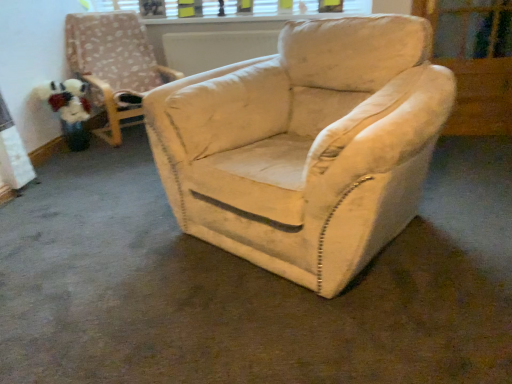
The width and height of the screenshot is (512, 384). What do you see at coordinates (69, 109) in the screenshot? I see `fluffy fabric toy at left` at bounding box center [69, 109].

The width and height of the screenshot is (512, 384). Identify the location of transparent glass screen door at upper right. (474, 61).

Where is `chair above the transparent glass screen door at upper right (from a real-world perspective)`? This screenshot has height=384, width=512. chair above the transparent glass screen door at upper right (from a real-world perspective) is located at coordinates (113, 63).

Is velvet beige armchair at center at the back of transparent glass screen door at upper right?

That's not correct — transparent glass screen door at upper right is not looking away from velvet beige armchair at center.

Which object is further away from the camera taking this photo, transparent glass screen door at upper right or velvet beige armchair at center?

Positioned behind is velvet beige armchair at center.

How distant is transparent glass screen door at upper right from velvet beige armchair at center?

The distance of transparent glass screen door at upper right from velvet beige armchair at center is 2.46 meters.

Where is `chair below the white plastic window frame at upper center (from the image's perspective)`? This screenshot has width=512, height=384. chair below the white plastic window frame at upper center (from the image's perspective) is located at coordinates point(113,63).

Can you confirm if white plastic window frame at upper center is smaller than velvet beige armchair at center?

Yes, white plastic window frame at upper center is smaller than velvet beige armchair at center.

Does point (254, 0) come farther from viewer compared to point (69, 65)?

Yes, point (254, 0) is farther from viewer.

How many degrees apart are the facing directions of velvet beige armchair at center and white plastic window frame at upper center?

The angle between the facing direction of velvet beige armchair at center and the facing direction of white plastic window frame at upper center is 47.7 degrees.

Locate an element on the screen. chair that is in front of the white plastic window frame at upper center is located at coordinates (113, 63).

Does point (89, 74) come closer to viewer compared to point (207, 4)?

Yes, point (89, 74) is in front of point (207, 4).

Considering the relative positions of velvet beige armchair at center and white plastic window frame at upper center in the image provided, is velvet beige armchair at center to the left or to the right of white plastic window frame at upper center?

velvet beige armchair at center is to the left of white plastic window frame at upper center.

Can you confirm if velvet beige armchair at center is positioned to the right of transparent glass screen door at upper right?

In fact, velvet beige armchair at center is to the left of transparent glass screen door at upper right.

From a real-world perspective, is velvet beige armchair at center located higher than transparent glass screen door at upper right?

Yes.

Does velvet beige armchair at center have a lesser height compared to transparent glass screen door at upper right?

In fact, velvet beige armchair at center may be taller than transparent glass screen door at upper right.

Is velvet beige armchair at center located outside transparent glass screen door at upper right?

velvet beige armchair at center lies outside transparent glass screen door at upper right's area.

At what (x,y) coordinates should I click in order to perform the action: click on screen door located in front of the fluffy fabric toy at left. Please return your answer as a coordinate pair (x, y). Looking at the image, I should click on (474, 61).

Based on the photo, does fluffy fabric toy at left lie in front of transparent glass screen door at upper right?

No, the depth of fluffy fabric toy at left is greater than that of transparent glass screen door at upper right.

From a real-world perspective, between fluffy fabric toy at left and transparent glass screen door at upper right, who is vertically lower?

fluffy fabric toy at left, from a real-world perspective.

You are a GUI agent. You are given a task and a screenshot of the screen. Output one action in this format:
    pyautogui.click(x=<x>, y=<y>)
    Task: Click on the window frame lying on the left of transparent glass screen door at upper right
    This screenshot has height=384, width=512.
    Given the screenshot: What is the action you would take?
    pyautogui.click(x=252, y=8)

Could you tell me if transparent glass screen door at upper right is turned towards white plastic window frame at upper center?

No, transparent glass screen door at upper right is not turned towards white plastic window frame at upper center.

From the image's perspective, is transparent glass screen door at upper right below white plastic window frame at upper center?

Yes, from the image's perspective, transparent glass screen door at upper right is beneath white plastic window frame at upper center.

Looking at their sizes, would you say transparent glass screen door at upper right is wider or thinner than white plastic window frame at upper center?

Clearly, transparent glass screen door at upper right has more width compared to white plastic window frame at upper center.

Which of these two, velvet beige armchair at center or fluffy fabric toy at left, stands shorter?

With less height is fluffy fabric toy at left.

Considering the positions of objects velvet beige armchair at center and fluffy fabric toy at left in the image provided, who is more to the left, velvet beige armchair at center or fluffy fabric toy at left?

Positioned to the left is fluffy fabric toy at left.

Is velvet beige armchair at center situated inside fluffy fabric toy at left or outside?

velvet beige armchair at center is outside fluffy fabric toy at left.

Where is `screen door that is under the velvet beige armchair at center (from a real-world perspective)`? The width and height of the screenshot is (512, 384). screen door that is under the velvet beige armchair at center (from a real-world perspective) is located at coordinates (x=474, y=61).

At what (x,y) coordinates should I click in order to perform the action: click on chair lying in front of the white plastic window frame at upper center. Please return your answer as a coordinate pair (x, y). This screenshot has width=512, height=384. Looking at the image, I should click on (113, 63).

Which object lies further to the anchor point fluffy fabric toy at left, white plastic window frame at upper center or transparent glass screen door at upper right?

Based on the image, transparent glass screen door at upper right appears to be further to fluffy fabric toy at left.

Based on the photo, looking at the image, which one is located further to white plastic window frame at upper center, transparent glass screen door at upper right or fluffy fabric toy at left?

Among the two, transparent glass screen door at upper right is located further to white plastic window frame at upper center.

Estimate the real-world distances between objects in this image. Which object is further from transparent glass screen door at upper right, white plastic window frame at upper center or fluffy fabric toy at left?

fluffy fabric toy at left is further to transparent glass screen door at upper right.

Consider the image. From the image, which object appears to be nearer to transparent glass screen door at upper right, velvet beige armchair at center or white plastic window frame at upper center?

white plastic window frame at upper center is closer to transparent glass screen door at upper right.

Estimate the real-world distances between objects in this image. Which object is further from white plastic window frame at upper center, velvet beige armchair at center or transparent glass screen door at upper right?

Based on the image, transparent glass screen door at upper right appears to be further to white plastic window frame at upper center.

Estimate the real-world distances between objects in this image. Which object is further from velvet beige armchair at center, transparent glass screen door at upper right or white plastic window frame at upper center?

The object further to velvet beige armchair at center is transparent glass screen door at upper right.

From the image, which object appears to be nearer to fluffy fabric toy at left, velvet beige armchair at center or white plastic window frame at upper center?

The object closer to fluffy fabric toy at left is velvet beige armchair at center.

Considering their positions, is white plastic window frame at upper center positioned further to velvet beige armchair at center than transparent glass screen door at upper right?

The object further to velvet beige armchair at center is transparent glass screen door at upper right.

Locate an element on the screen. This screenshot has height=384, width=512. chair between white plastic window frame at upper center and fluffy fabric toy at left in the vertical direction is located at coordinates (113, 63).

Identify the location of window frame between velvet beige armchair at center and transparent glass screen door at upper right from left to right. (x=252, y=8).

The image size is (512, 384). Identify the location of window frame between fluffy fabric toy at left and transparent glass screen door at upper right. pos(252,8).

Where is `chair situated between fluffy fabric toy at left and transparent glass screen door at upper right from left to right`? This screenshot has width=512, height=384. chair situated between fluffy fabric toy at left and transparent glass screen door at upper right from left to right is located at coordinates (113, 63).